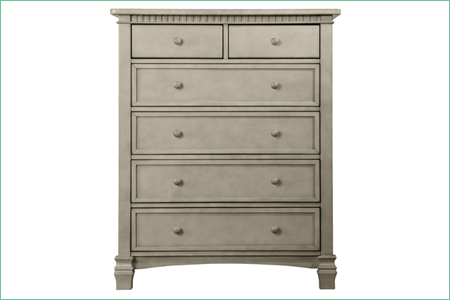
This screenshot has width=450, height=300. I want to click on dresser stands on the floor here, so click(126, 285), click(328, 283).